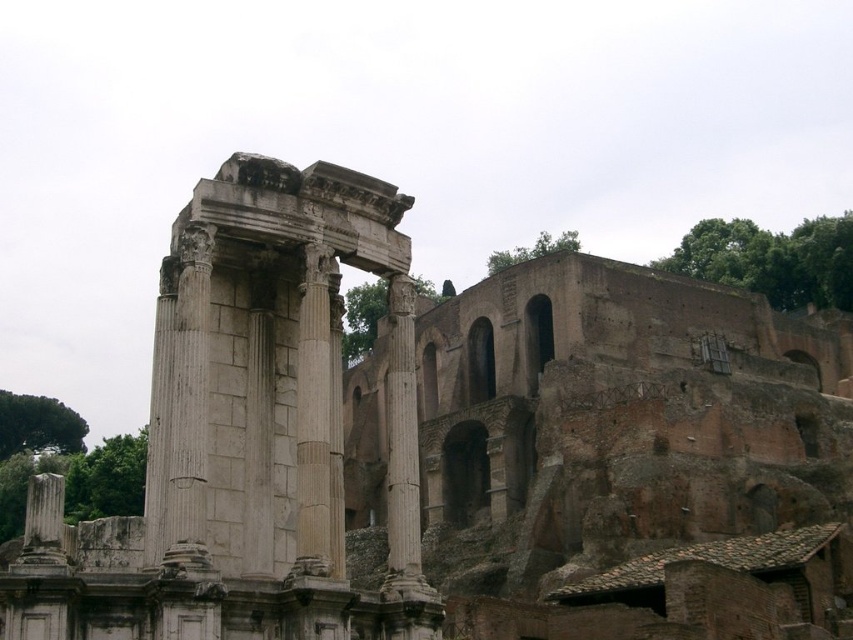
Consider the image. Is white marble column at center bigger than smooth stone column at center?

No.

Does point (302, 465) lie in front of point (410, 448)?

Yes, point (302, 465) is in front of point (410, 448).

In order to click on white marble column at center in this screenshot , I will do `click(312, 416)`.